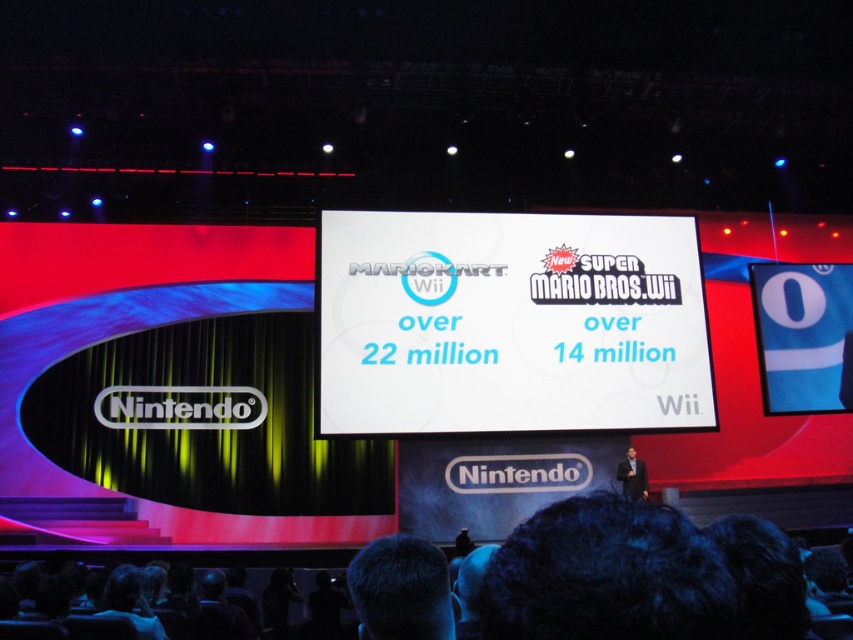
You are an attendee at the Nintendo event. You see the white glossy projection screen at center and the dark suit at lower right. Which object is closer to the left side of the stage?

The white glossy projection screen at center is to the left of the dark suit at lower right, so it is closer to the left side of the stage.

You are an event photographer positioned at the back of the venue. You need to capture a photo of both the white glossy projection screen at center and the blue fabric at center. Based on their positions, which object should you frame first in your camera viewfinder to ensure both are in the shot?

The white glossy projection screen at center is to the left of the blue fabric at center, so you should frame the white glossy projection screen at center first to ensure both are included in the shot.